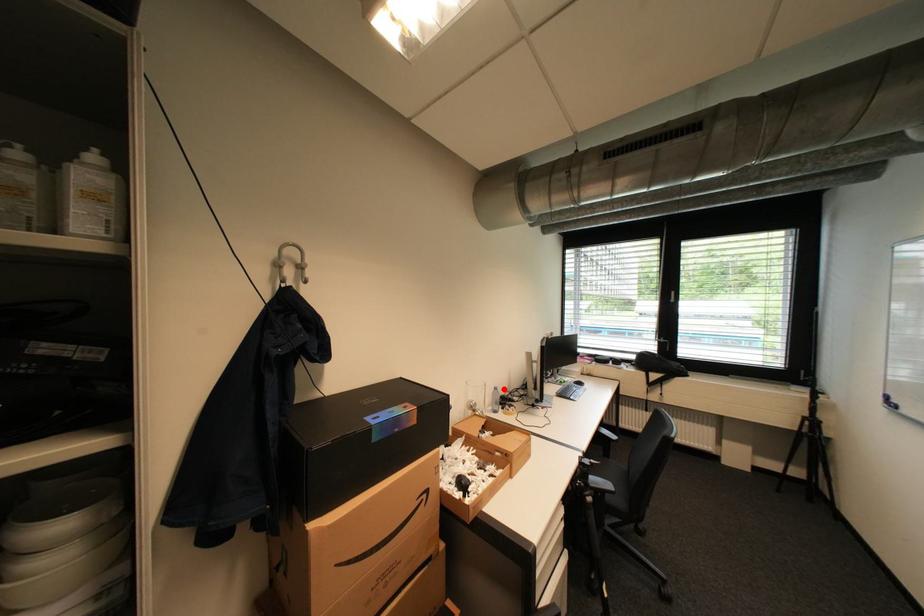
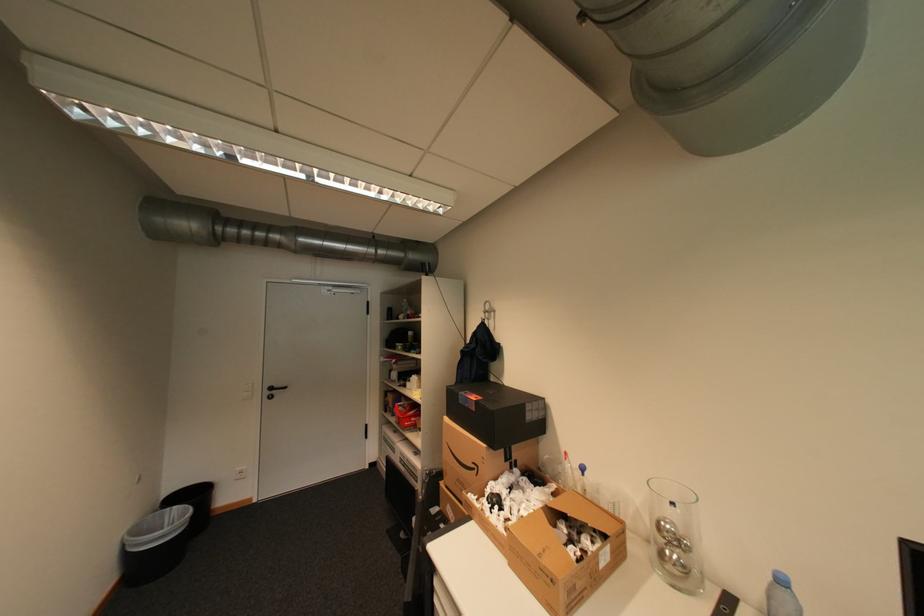
Question: I am providing you with two images of the same scene from different viewpoints. A red point is marked on the first image. Can you still see the location of the red point in image 2?

Choices:
 (A) Yes
 (B) No

Answer: (A)